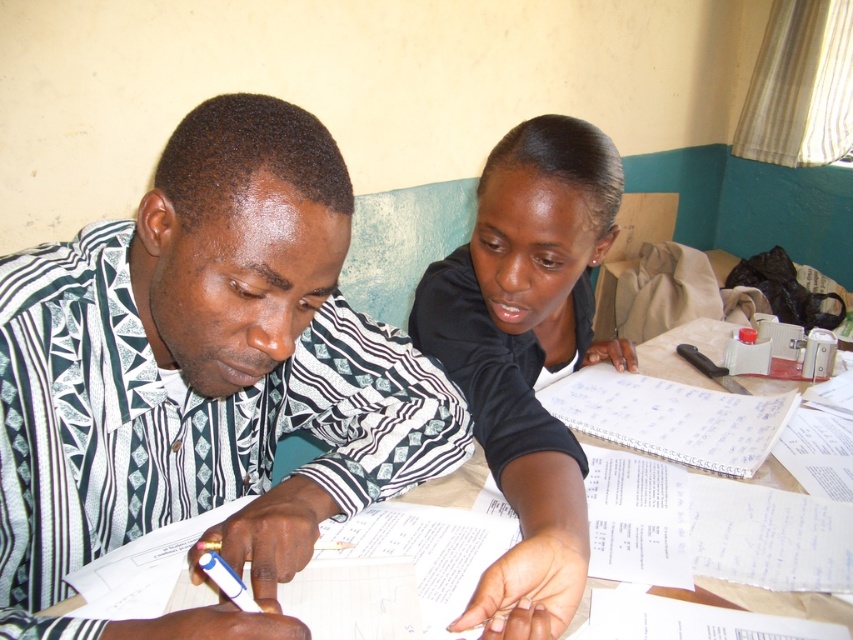
Question: Is patterned fabric shirt at center to the left of white paper at center from the viewer's perspective?

Choices:
 (A) no
 (B) yes

Answer: (B)

Question: Is black matte shirt at upper center smaller than white paper at center?

Choices:
 (A) no
 (B) yes

Answer: (A)

Question: Estimate the real-world distances between objects in this image. Which object is farther from the patterned fabric shirt at center?

Choices:
 (A) white plastic pen at center
 (B) white paper at center

Answer: (B)

Question: Can you confirm if black matte shirt at upper center is positioned below white plastic pen at center?

Choices:
 (A) yes
 (B) no

Answer: (B)

Question: Among these objects, which one is nearest to the camera?

Choices:
 (A) white plastic pen at center
 (B) patterned fabric shirt at center
 (C) white paper at center

Answer: (B)

Question: Which of the following is the farthest from the observer?

Choices:
 (A) patterned fabric shirt at center
 (B) black matte shirt at upper center

Answer: (B)